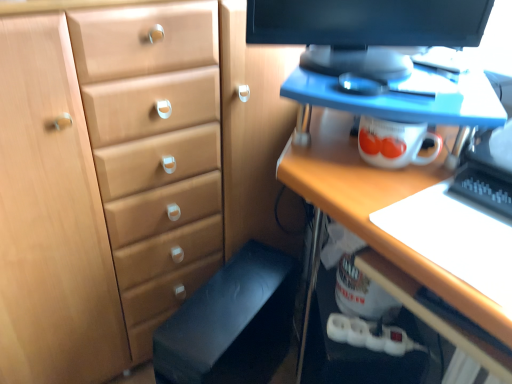
Question: Considering the relative sizes of black fabric computer chair at lower center and black glossy monitor at upper center in the image provided, is black fabric computer chair at lower center shorter than black glossy monitor at upper center?

Choices:
 (A) yes
 (B) no

Answer: (B)

Question: Is black fabric computer chair at lower center smaller than black glossy monitor at upper center?

Choices:
 (A) yes
 (B) no

Answer: (B)

Question: Does black fabric computer chair at lower center come behind black glossy monitor at upper center?

Choices:
 (A) no
 (B) yes

Answer: (B)

Question: From a real-world perspective, is black fabric computer chair at lower center over black glossy monitor at upper center?

Choices:
 (A) yes
 (B) no

Answer: (B)

Question: Are black fabric computer chair at lower center and black glossy monitor at upper center beside each other?

Choices:
 (A) no
 (B) yes

Answer: (A)

Question: From a real-world perspective, is matte wood desk at upper right above or below black fabric computer chair at lower center?

Choices:
 (A) below
 (B) above

Answer: (B)

Question: In the image, is matte wood desk at upper right positioned in front of or behind black fabric computer chair at lower center?

Choices:
 (A) front
 (B) behind

Answer: (A)

Question: Is matte wood desk at upper right inside the boundaries of black fabric computer chair at lower center, or outside?

Choices:
 (A) inside
 (B) outside

Answer: (B)

Question: Considering the positions of matte wood desk at upper right and black fabric computer chair at lower center in the image, is matte wood desk at upper right wider or thinner than black fabric computer chair at lower center?

Choices:
 (A) wide
 (B) thin

Answer: (B)

Question: Considering the relative positions of black fabric computer chair at lower center and matte wood desk at upper right in the image provided, is black fabric computer chair at lower center to the left or to the right of matte wood desk at upper right?

Choices:
 (A) right
 (B) left

Answer: (B)

Question: Considering the positions of point (234, 337) and point (406, 258), is point (234, 337) closer or farther from the camera than point (406, 258)?

Choices:
 (A) closer
 (B) farther

Answer: (B)

Question: In terms of height, does black fabric computer chair at lower center look taller or shorter compared to matte wood desk at upper right?

Choices:
 (A) short
 (B) tall

Answer: (A)

Question: Considering the positions of black fabric computer chair at lower center and matte wood desk at upper right in the image, is black fabric computer chair at lower center wider or thinner than matte wood desk at upper right?

Choices:
 (A) wide
 (B) thin

Answer: (A)

Question: Is point (186, 104) closer or farther from the camera than point (273, 284)?

Choices:
 (A) closer
 (B) farther

Answer: (A)

Question: Based on their sizes in the image, would you say light brown wood chest of drawers at center is bigger or smaller than black fabric computer chair at lower center?

Choices:
 (A) small
 (B) big

Answer: (B)